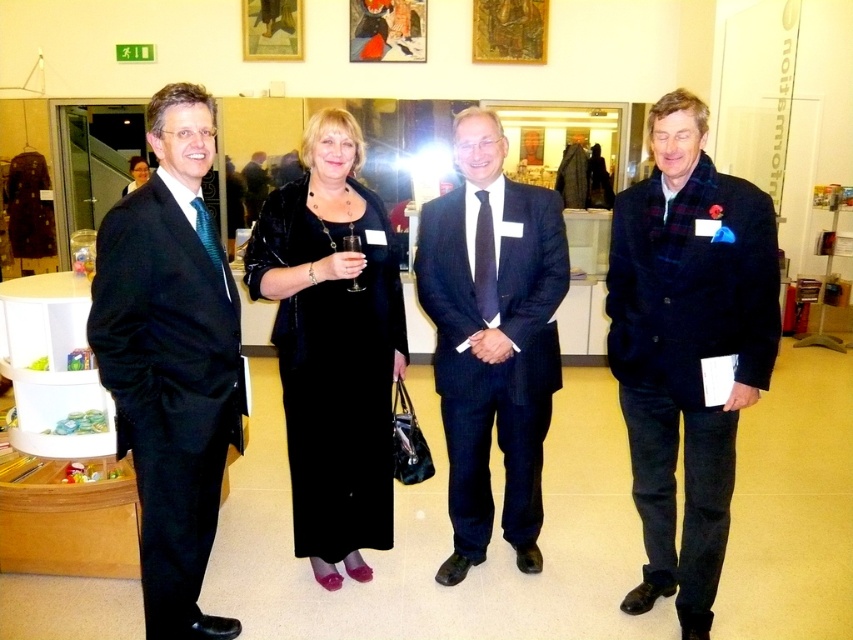
Can you confirm if velvet black blazer at right is positioned to the right of wooden picture frame at upper center?

Yes, velvet black blazer at right is to the right of wooden picture frame at upper center.

Is velvet black blazer at right taller than wooden picture frame at upper center?

Yes.

Does point (695, 336) come closer to viewer compared to point (268, 51)?

Yes.

You are a GUI agent. You are given a task and a screenshot of the screen. Output one action in this format:
    pyautogui.click(x=<x>, y=<y>)
    Task: Click on the velvet black blazer at right
    
    Given the screenshot: What is the action you would take?
    pyautogui.click(x=688, y=346)

Can you confirm if shiny black suit at left is bigger than dark blue suit at center?

Incorrect, shiny black suit at left is not larger than dark blue suit at center.

From the picture: Does shiny black suit at left appear on the right side of dark blue suit at center?

In fact, shiny black suit at left is to the left of dark blue suit at center.

Locate an element on the screen. The width and height of the screenshot is (853, 640). shiny black suit at left is located at coordinates (171, 358).

Locate an element on the screen. The image size is (853, 640). shiny black suit at left is located at coordinates (171, 358).

Looking at this image, which is above, velvet black blazer at right or dark blue suit at center?

dark blue suit at center is above.

Consider the image. Can you confirm if velvet black blazer at right is shorter than dark blue suit at center?

No.

Is point (622, 392) positioned in front of point (454, 211)?

Yes, point (622, 392) is closer to viewer.

Where is `velvet black blazer at right`? The image size is (853, 640). velvet black blazer at right is located at coordinates (688, 346).